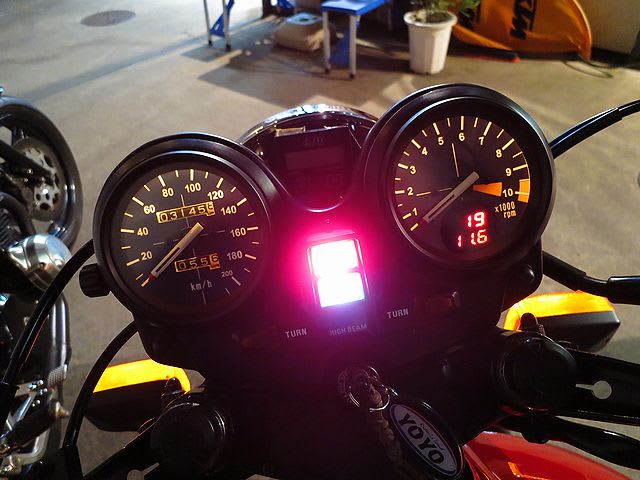
The height and width of the screenshot is (480, 640). I want to click on clocks, so click(x=456, y=172), click(x=191, y=232).